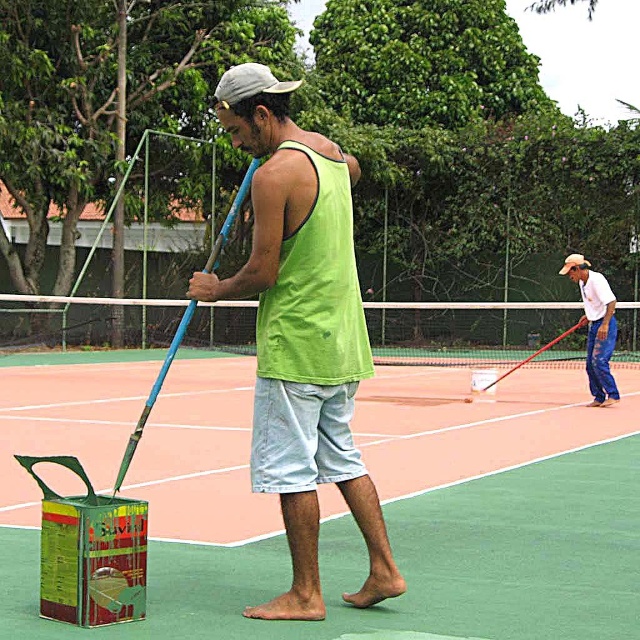
Does light blue jeans at right have a lesser width compared to blue wooden tennis racket at center?

Yes.

Is light blue jeans at right below blue wooden tennis racket at center?

Yes, light blue jeans at right is below blue wooden tennis racket at center.

Identify the location of light blue jeans at right. (595, 326).

Where is `light blue jeans at right`? light blue jeans at right is located at coordinates 595,326.

Is green rubber tennis court at center above blue wooden tennis racket at center?

Incorrect, green rubber tennis court at center is not positioned above blue wooden tennis racket at center.

Between green rubber tennis court at center and blue wooden tennis racket at center, which one appears on the right side from the viewer's perspective?

Positioned to the right is green rubber tennis court at center.

Consider the image. Who is more forward, (536, 554) or (129, 449)?

A: Point (129, 449) is in front.

At what (x,y) coordinates should I click in order to perform the action: click on green rubber tennis court at center. Please return your answer as a coordinate pair (x, y). Looking at the image, I should click on (340, 500).

Between green fabric tank top at center and blue wooden tennis racket at center, which one has less height?

green fabric tank top at center

Is point (282, 609) farther from camera compared to point (248, 189)?

No, (282, 609) is closer to viewer.

Is point (282, 152) in front of point (138, 442)?

That is True.

This screenshot has height=640, width=640. Identify the location of green fabric tank top at center. 301,333.